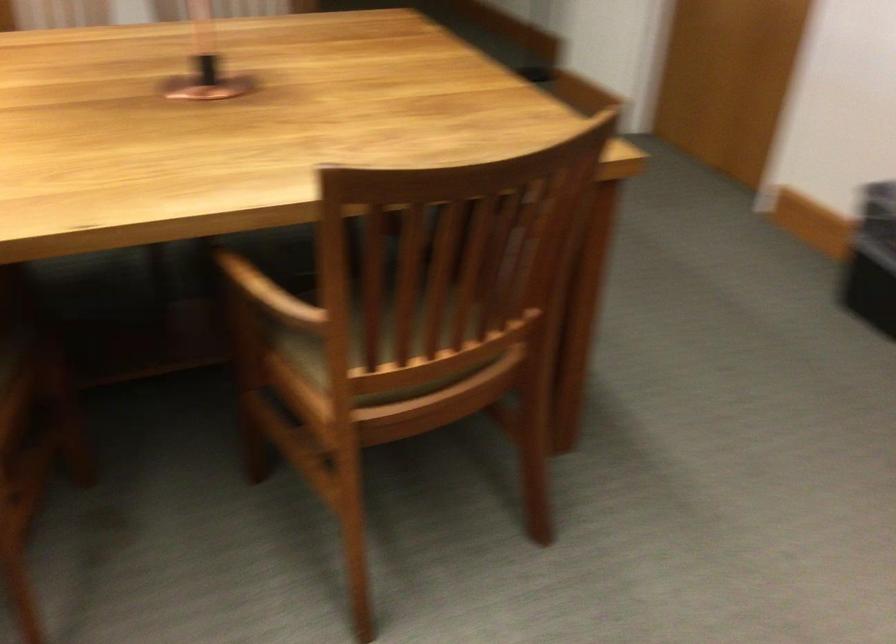
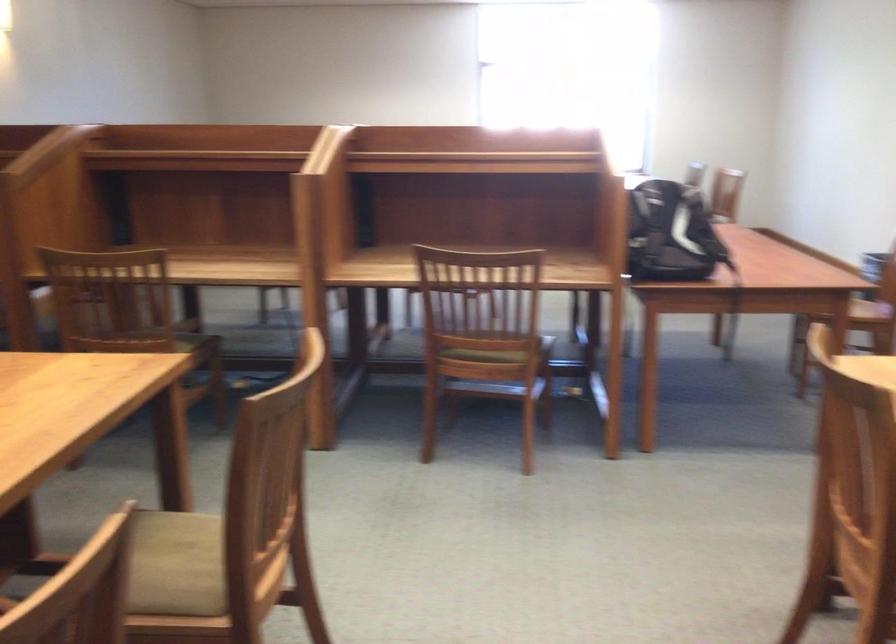
How did the camera likely rotate?

The rotation direction of the camera is left-down.